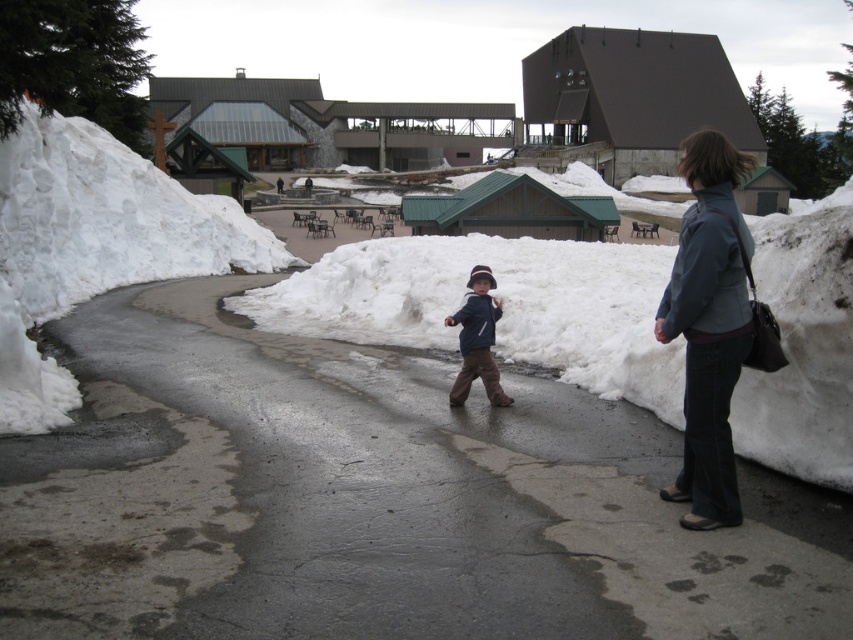
You are standing at the camera position and want to walk to the smooth asphalt road at center. According to the coordinates provided, in which direction should you move relative to your current position?

The smooth asphalt road at center is located at coordinates point (372, 500). Since the y coordinate is 0.437, which is below the center of the image, you should move forward towards the road.

You are a pedestrian trying to cross the road safely. You see a denim jacket at right and a matte blue jacket at center. Which jacket is closer to you?

The denim jacket at right is closer to you because it is in front of the matte blue jacket at center.

You are a photographer trying to capture the child and the woman in the snowy scene. You notice the white fluffy snow at center and the brushed blue jacket at center. Which object is higher in the image?

The white fluffy snow at center is above the brushed blue jacket at center, so the white fluffy snow at center is higher in the image.